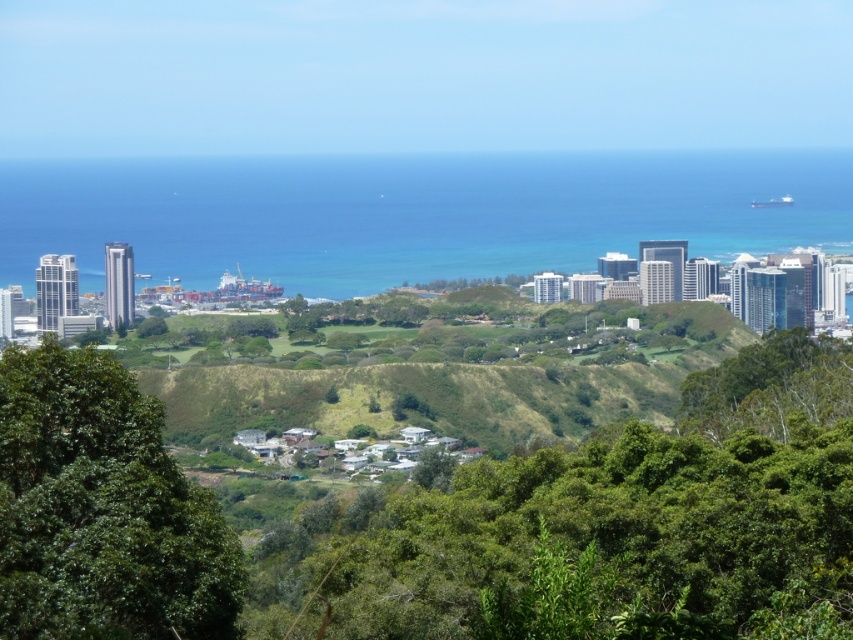
The height and width of the screenshot is (640, 853). What do you see at coordinates (602, 525) in the screenshot?
I see `green leafy trees at center` at bounding box center [602, 525].

Between point (498, 518) and point (36, 536), which one is positioned in front?

Point (498, 518) is more forward.

Identify the location of green leafy trees at center. (602, 525).

Does green leafy trees at center appear under blue water at center?

Yes, green leafy trees at center is below blue water at center.

Does point (688, 525) come farther from viewer compared to point (354, 173)?

Yes, it is behind point (354, 173).

Measure the distance between point (613, 518) and camera.

The distance of point (613, 518) from camera is 656.94 meters.

What are the coordinates of `green leafy trees at center` in the screenshot? It's located at (602, 525).

Does point (376, 259) come closer to viewer compared to point (25, 419)?

Yes.

Which is more to the left, blue water at center or green leafy tree at center-left?

green leafy tree at center-left is more to the left.

Measure the distance between point (358, 292) and camera.

Point (358, 292) and camera are 648.78 meters apart from each other.

Identify the location of blue water at center. (409, 212).